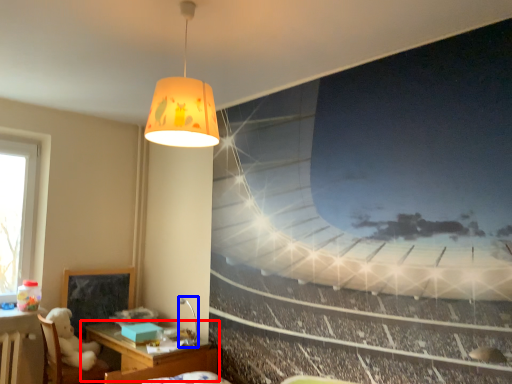
Question: Which of the following is the closest to the observer, table (highlighted by a red box) or lamp (highlighted by a blue box)?

Choices:
 (A) table
 (B) lamp

Answer: (A)